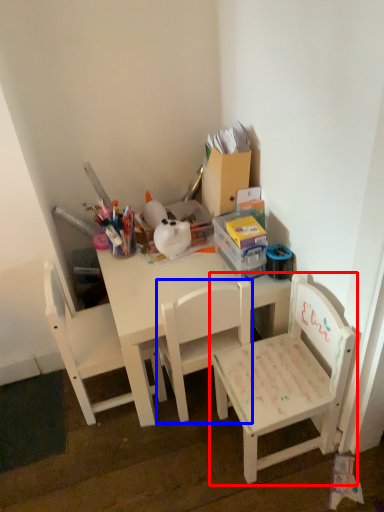
Question: Which object is further to the camera taking this photo, chair (highlighted by a red box) or chair (highlighted by a blue box)?

Choices:
 (A) chair
 (B) chair

Answer: (B)